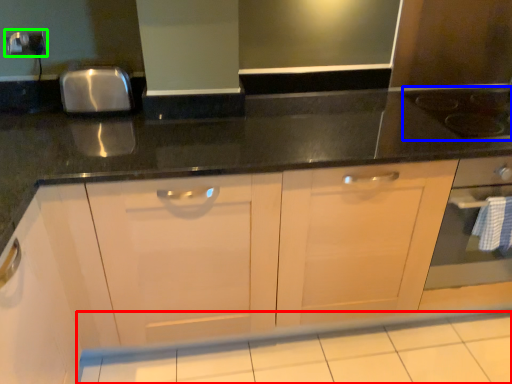
Question: Which object is positioned farthest from tile (highlighted by a red box)? Select from gas stove (highlighted by a blue box) and electric outlet (highlighted by a green box).

Choices:
 (A) gas stove
 (B) electric outlet

Answer: (B)